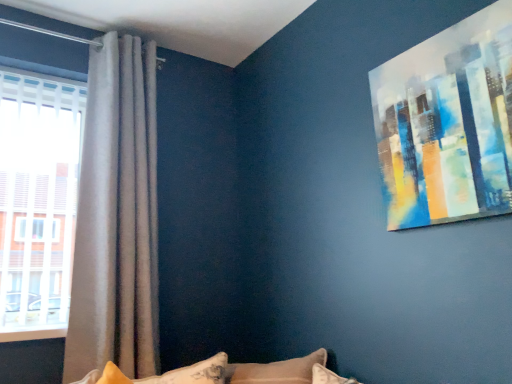
Question: Is satin grey curtain at left at the right side of acrylic painting at upper right?

Choices:
 (A) yes
 (B) no

Answer: (B)

Question: Does satin grey curtain at left have a larger size compared to acrylic painting at upper right?

Choices:
 (A) yes
 (B) no

Answer: (A)

Question: Is satin grey curtain at left taller than acrylic painting at upper right?

Choices:
 (A) no
 (B) yes

Answer: (B)

Question: From a real-world perspective, is satin grey curtain at left on acrylic painting at upper right?

Choices:
 (A) yes
 (B) no

Answer: (B)

Question: From a real-world perspective, is satin grey curtain at left below acrylic painting at upper right?

Choices:
 (A) no
 (B) yes

Answer: (B)

Question: Visually, is satin grey curtain at left positioned to the left or to the right of fluffy white pillow at lower center?

Choices:
 (A) right
 (B) left

Answer: (B)

Question: From the image's perspective, relative to fluffy white pillow at lower center, is satin grey curtain at left above or below?

Choices:
 (A) above
 (B) below

Answer: (A)

Question: In terms of width, does satin grey curtain at left look wider or thinner when compared to fluffy white pillow at lower center?

Choices:
 (A) wide
 (B) thin

Answer: (B)

Question: Considering the positions of point (111, 81) and point (186, 377), is point (111, 81) closer or farther from the camera than point (186, 377)?

Choices:
 (A) closer
 (B) farther

Answer: (B)

Question: Considering the positions of fluffy white pillow at lower center and acrylic painting at upper right in the image, is fluffy white pillow at lower center taller or shorter than acrylic painting at upper right?

Choices:
 (A) tall
 (B) short

Answer: (B)

Question: From the image's perspective, relative to acrylic painting at upper right, is fluffy white pillow at lower center above or below?

Choices:
 (A) below
 (B) above

Answer: (A)

Question: In the image, is fluffy white pillow at lower center on the left side or the right side of acrylic painting at upper right?

Choices:
 (A) left
 (B) right

Answer: (A)

Question: Is fluffy white pillow at lower center in front of or behind acrylic painting at upper right in the image?

Choices:
 (A) behind
 (B) front

Answer: (A)

Question: Considering the positions of acrylic painting at upper right and fluffy white pillow at lower center in the image, is acrylic painting at upper right wider or thinner than fluffy white pillow at lower center?

Choices:
 (A) wide
 (B) thin

Answer: (B)

Question: In the image, is acrylic painting at upper right positioned in front of or behind fluffy white pillow at lower center?

Choices:
 (A) behind
 (B) front

Answer: (B)